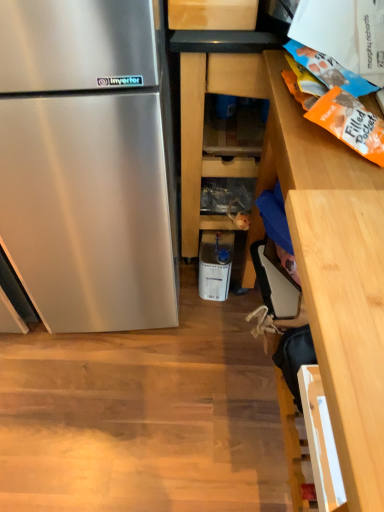
Image resolution: width=384 pixels, height=512 pixels. I want to click on free space in front of white plastic container at center, so click(211, 324).